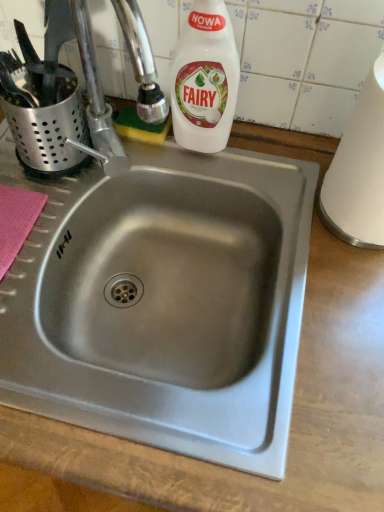
Identify the location of vacant space that is to the left of white plastic bottle at upper center. (123, 167).